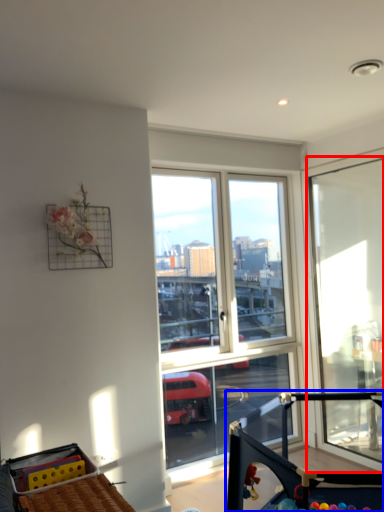
Question: Which object is closer to the camera taking this photo, window (highlighted by a red box) or baby carriage (highlighted by a blue box)?

Choices:
 (A) window
 (B) baby carriage

Answer: (B)